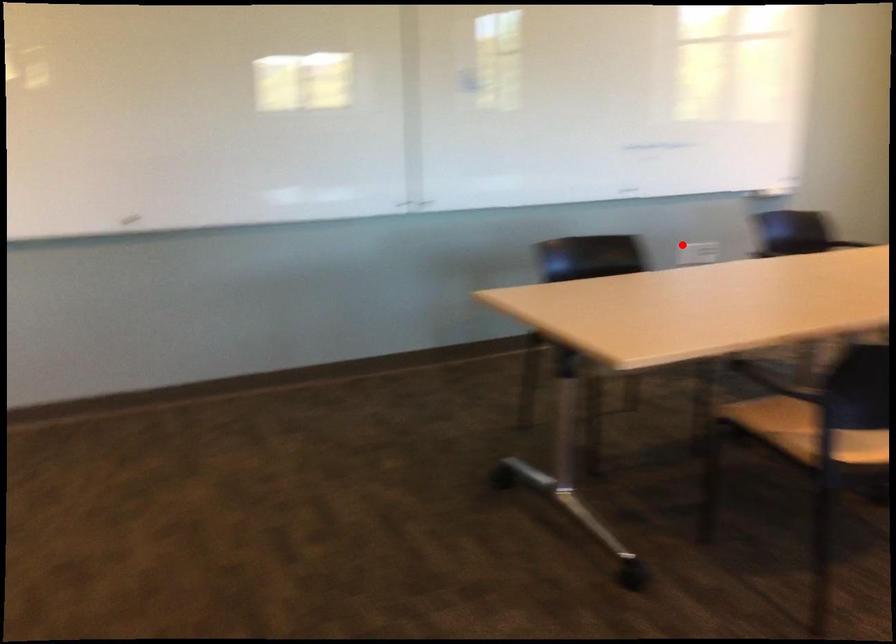
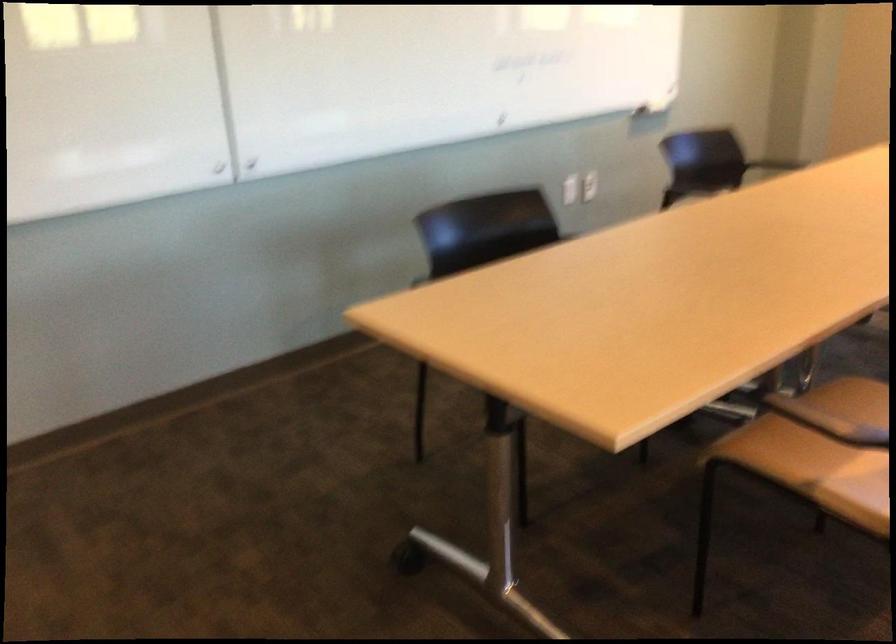
Question: A red point is marked in image1. In image2, is the corresponding 3D point closer to the camera or farther? Reply with the corresponding letter.

Choices:
 (A) The corresponding 3D point is closer.
 (B) The corresponding 3D point is farther.

Answer: (A)